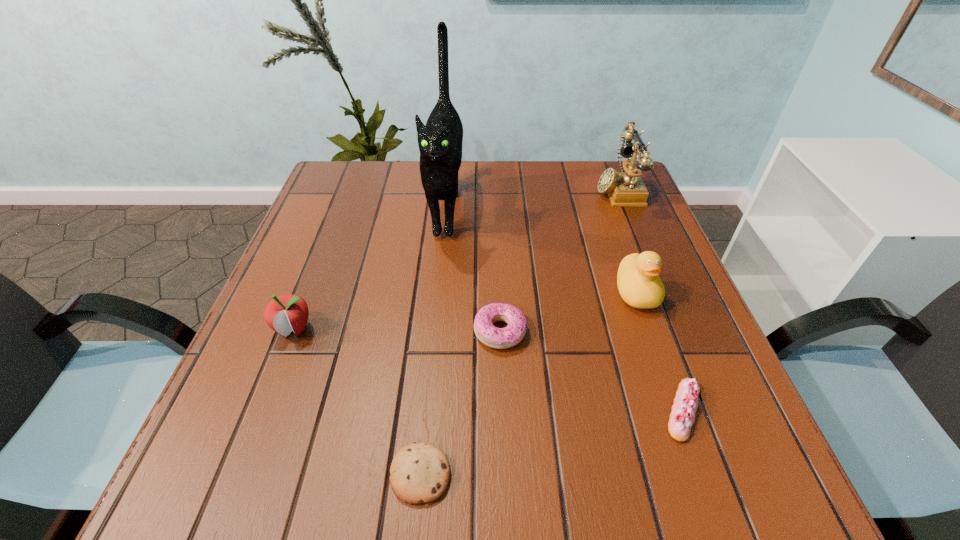
Where is `empty space that is in between the second tallest object and the fifth tallest object`? empty space that is in between the second tallest object and the fifth tallest object is located at coordinates (559, 260).

You are a GUI agent. You are given a task and a screenshot of the screen. Output one action in this format:
    pyautogui.click(x=<x>, y=<y>)
    Task: Click on the free spot between the third tallest object and the nearest object
    The image size is (960, 540).
    Given the screenshot: What is the action you would take?
    tap(528, 383)

Identify which object is located as the second nearest to the third tallest object. Please provide its 2D coordinates. Your answer should be formatted as a tuple, i.e. [(x, y)], where the tuple contains the x and y coordinates of a point satisfying the conditions above.

[(499, 338)]

Find the location of a particular element. object that is the third closest one to the apple is located at coordinates pos(499,338).

In order to click on vacant region that satisfies the following two spatial constraints: 1. on the front side of the shortest object; 2. on the left side of the fourth shortest object in this screenshot , I will do `click(238, 474)`.

Where is `free point that satisfies the following two spatial constraints: 1. on the face of the eclair; 2. on the left side of the duck`? The width and height of the screenshot is (960, 540). free point that satisfies the following two spatial constraints: 1. on the face of the eclair; 2. on the left side of the duck is located at coordinates 678,410.

Find the location of a particular element. Image resolution: width=960 pixels, height=540 pixels. vacant space that satisfies the following two spatial constraints: 1. on the front side of the second nearest object; 2. on the left side of the apple is located at coordinates (263, 410).

Where is `free location that satisfies the following two spatial constraints: 1. on the front side of the eclair; 2. on the right side of the fourth tallest object`? This screenshot has height=540, width=960. free location that satisfies the following two spatial constraints: 1. on the front side of the eclair; 2. on the right side of the fourth tallest object is located at coordinates (263, 410).

Find the location of a particular element. The width and height of the screenshot is (960, 540). free space that satisfies the following two spatial constraints: 1. on the dial number of the second tallest object; 2. on the face of the third tallest object is located at coordinates (659, 292).